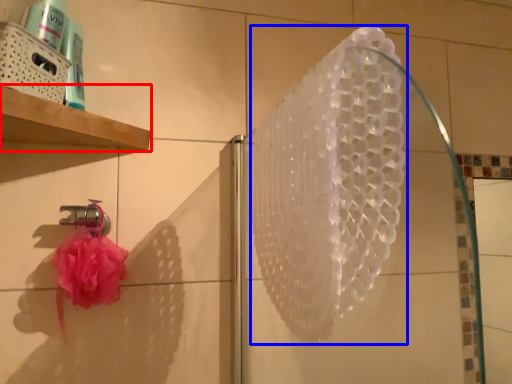
Question: Which of the following is the closest to the observer, shelf (highlighted by a red box) or shower (highlighted by a blue box)?

Choices:
 (A) shelf
 (B) shower

Answer: (B)